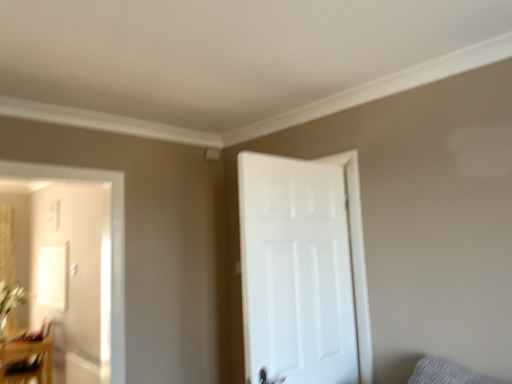
Question: Is wooden table at lower left in front of or behind white matte door at right in the image?

Choices:
 (A) behind
 (B) front

Answer: (A)

Question: Considering the relative positions of wooden table at lower left and white matte door at right in the image provided, is wooden table at lower left to the left or to the right of white matte door at right?

Choices:
 (A) left
 (B) right

Answer: (A)

Question: Which object is positioned farthest from the gray fabric pillow at lower right?

Choices:
 (A) green leafy plant at left
 (B) wooden table at lower left
 (C) white matte door at right

Answer: (A)

Question: Which object is the farthest from the green leafy plant at left?

Choices:
 (A) gray fabric pillow at lower right
 (B) white matte door at right
 (C) wooden table at lower left

Answer: (A)